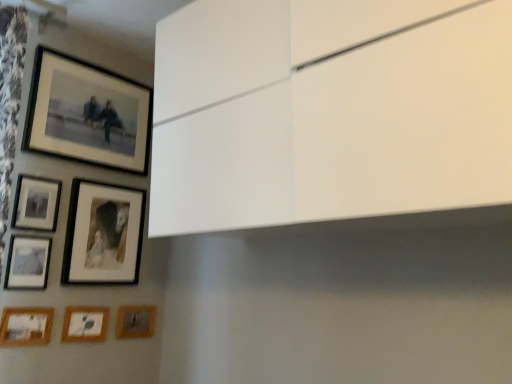
Question: Does point (27, 281) appear closer or farther from the camera than point (71, 327)?

Choices:
 (A) farther
 (B) closer

Answer: (B)

Question: Based on their positions, is matte black picture frame at lower left, acting as the 4th picture frame starting from the bottom, located to the left or right of wooden matte picture frame at lower left, the second picture frame ordered from the bottom?

Choices:
 (A) left
 (B) right

Answer: (A)

Question: Based on their relative distances, which object is farther from the wooden photo frame at lower left, acting as the third picture frame starting from the bottom?

Choices:
 (A) matte black picture frame at lower left, the fourth picture frame from the top
 (B) wooden matte picture frame at lower left, the second picture frame ordered from the bottom
 (C) matte black picture frame at lower left, the fifth picture frame from the bottom
 (D) matte black picture frame at upper left, the seventh picture frame positioned from the bottom
 (E) wooden textured picture frame at lower center, which is the 1th picture frame from bottom to top

Answer: (D)

Question: Estimate the real-world distances between objects in this image. Which object is closer to the wooden textured picture frame at lower center, which is the 1th picture frame from bottom to top?

Choices:
 (A) matte black picture frame at lower left, the fourth picture frame from the top
 (B) wooden photo frame at lower left, which is counted as the fifth picture frame, starting from the top
 (C) matte black picture frame at lower left, the fifth picture frame from the bottom
 (D) wooden matte picture frame at lower left, the second picture frame ordered from the bottom
 (E) matte black picture frame at upper left, positioned as the second picture frame in top-to-bottom order

Answer: (D)